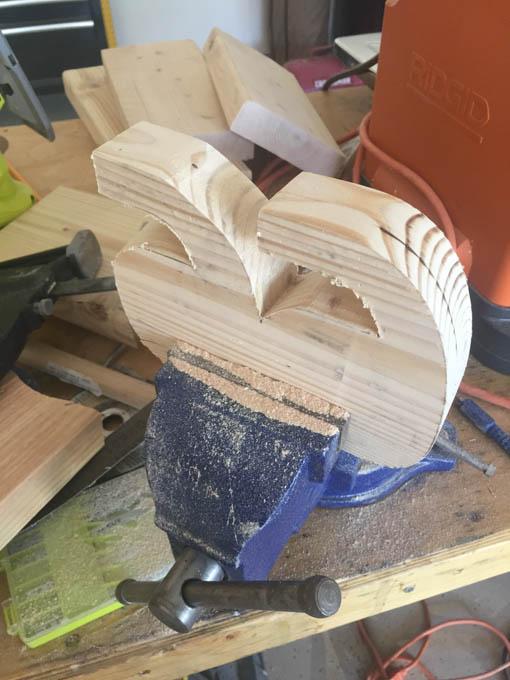
The height and width of the screenshot is (680, 510). What are the coordinates of `orange cord` in the screenshot? It's located at (399, 676).